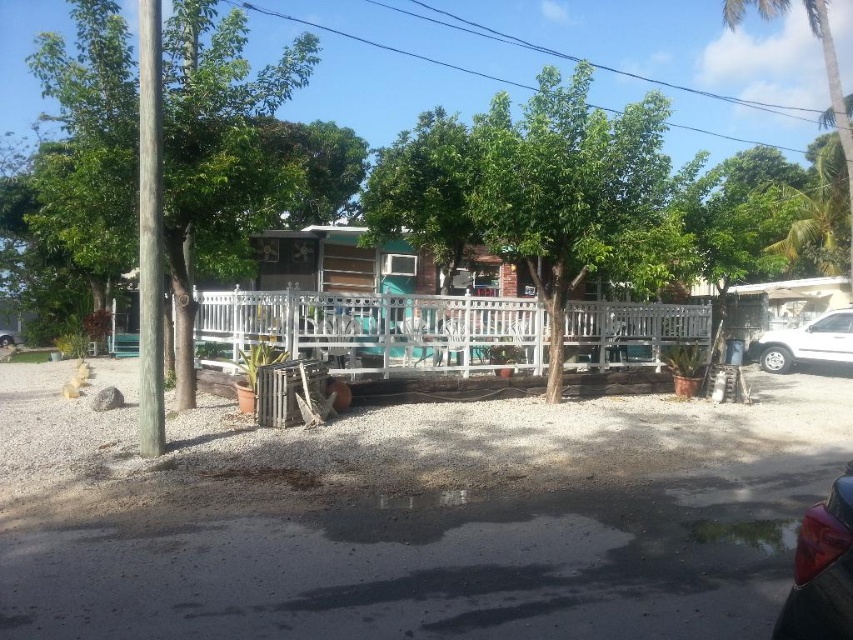
Question: Is white matte suv at right bigger than green leafy tree at upper right?

Choices:
 (A) yes
 (B) no

Answer: (B)

Question: Which object appears farthest from the camera in this image?

Choices:
 (A) green leafy tree at center
 (B) glossy plastic car at lower right

Answer: (A)

Question: Does green leafy tree at left have a greater width compared to green leafy tree at upper right?

Choices:
 (A) no
 (B) yes

Answer: (B)

Question: Among these points, which one is nearest to the camera?

Choices:
 (A) (759, 348)
 (B) (804, 577)

Answer: (B)

Question: Is green leafy tree at center below green leafy tree at left?

Choices:
 (A) yes
 (B) no

Answer: (A)

Question: Which point is farther to the camera?

Choices:
 (A) green leafy tree at upper right
 (B) green leafy tree at left

Answer: (A)